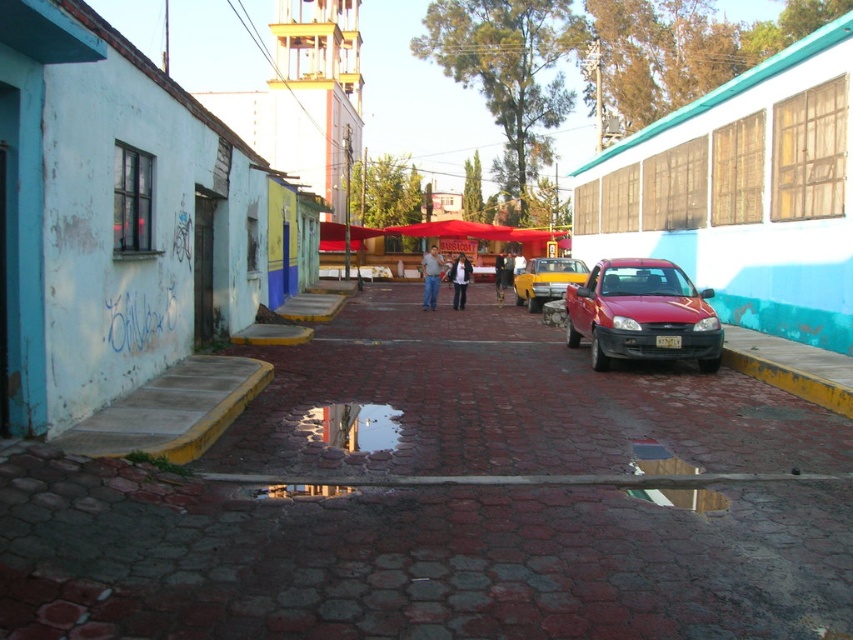
Question: Among these points, which one is farthest from the camera?

Choices:
 (A) (x=428, y=282)
 (B) (x=801, y=435)
 (C) (x=538, y=266)

Answer: (C)

Question: Does glossy red car at center have a greater width compared to dark blue jeans at center?

Choices:
 (A) no
 (B) yes

Answer: (B)

Question: From the image, what is the correct spatial relationship of denim jeans at center in relation to denim jacket at center?

Choices:
 (A) below
 (B) above

Answer: (A)

Question: Among these objects, which one is farthest from the camera?

Choices:
 (A) denim jacket at center
 (B) denim jeans at center

Answer: (A)

Question: Based on their relative distances, which object is nearer to the dark blue jeans at center?

Choices:
 (A) brick at center
 (B) yellow metallic car at center
 (C) denim jacket at center
 (D) glossy red car at center

Answer: (B)

Question: Can you confirm if brick at center is positioned above transparent glass puddle at center?

Choices:
 (A) no
 (B) yes

Answer: (B)